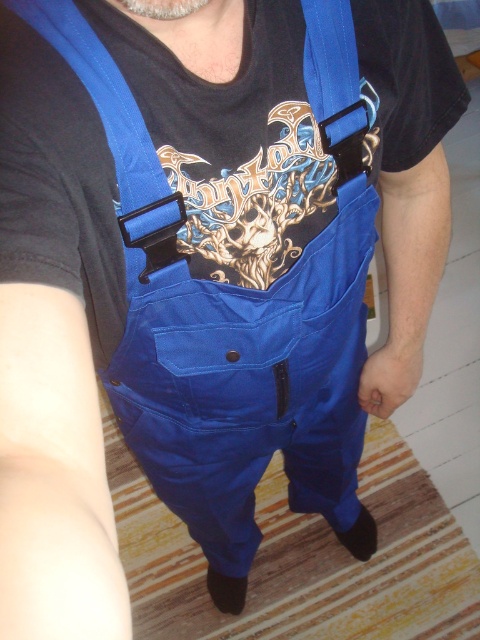
Does blue fabric suspenders at upper center appear under matte blue straps at upper center?

Correct, blue fabric suspenders at upper center is located below matte blue straps at upper center.

How distant is blue fabric suspenders at upper center from matte blue straps at upper center?

blue fabric suspenders at upper center and matte blue straps at upper center are 5.38 inches apart from each other.

From the picture: Measure the distance between blue fabric suspenders at upper center and camera.

blue fabric suspenders at upper center and camera are 15.07 inches apart from each other.

This screenshot has height=640, width=480. Identify the location of blue fabric suspenders at upper center. (131, 157).